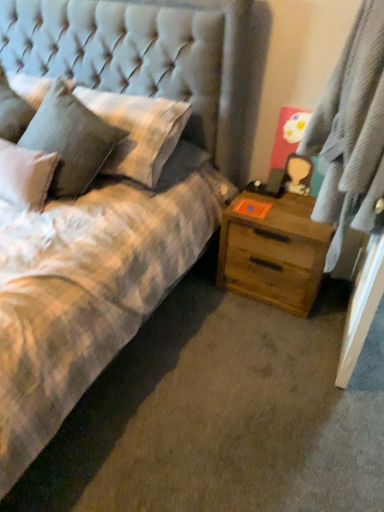
You are a GUI agent. You are given a task and a screenshot of the screen. Output one action in this format:
    pyautogui.click(x=<x>, y=<y>)
    Task: Click on the vacant space situated above wooden nightstand at right (from a real-world perspective)
    Image resolution: width=384 pixels, height=512 pixels.
    Given the screenshot: What is the action you would take?
    pyautogui.click(x=274, y=202)